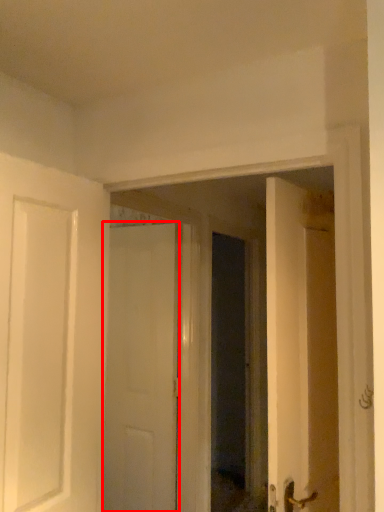
Question: From the image's perspective, where is door (annotated by the red box) located in relation to glass door in the image?

Choices:
 (A) below
 (B) above

Answer: (A)